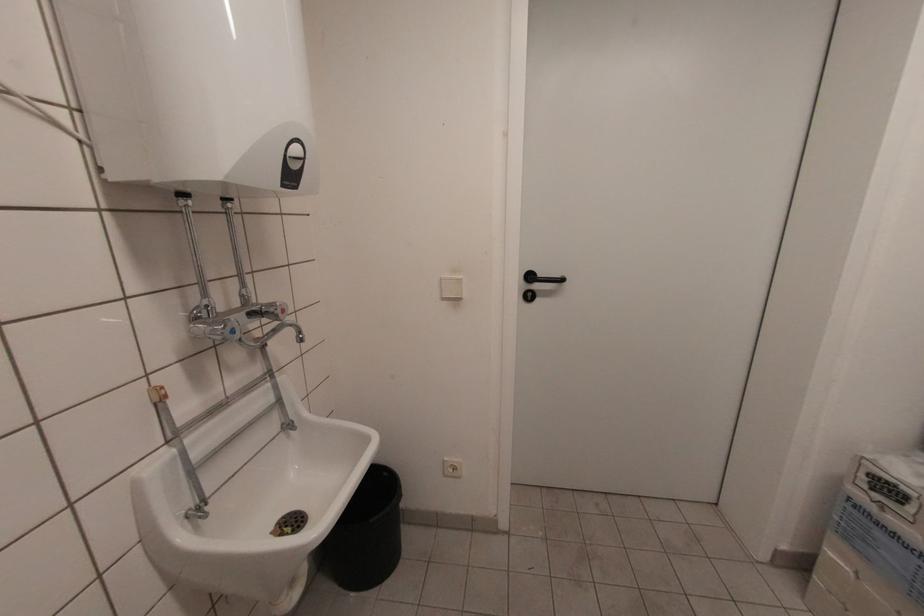
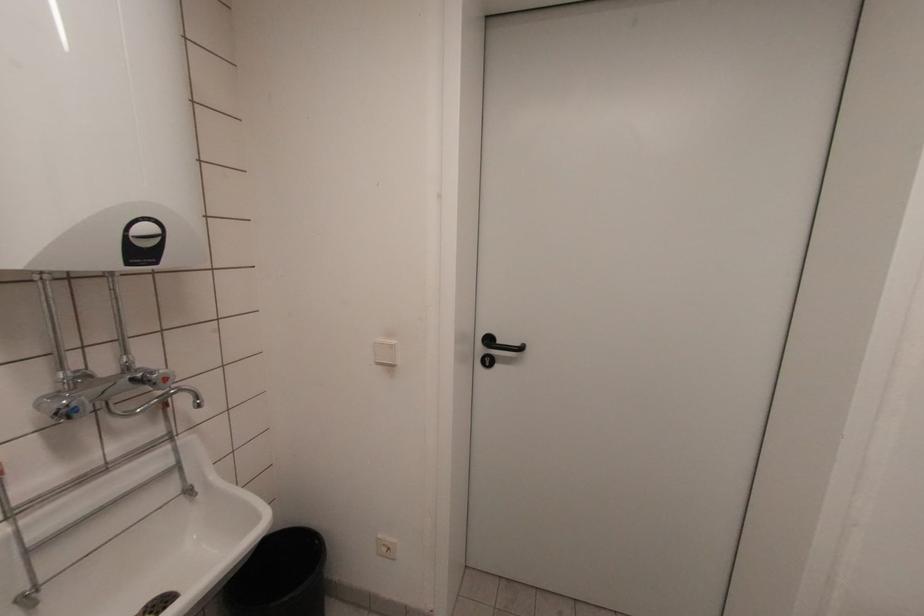
Locate, in the second image, the point that corresponds to point 443,292 in the first image.

(375, 355)